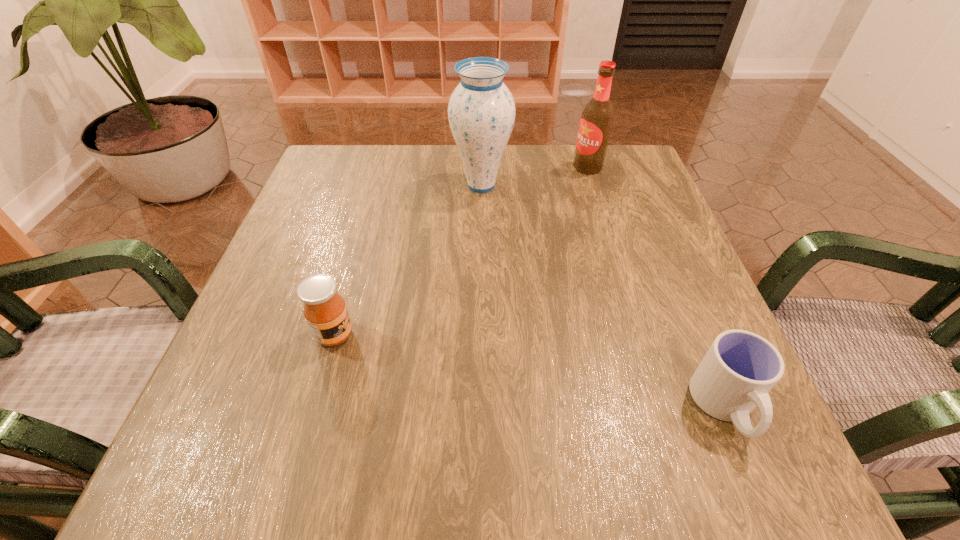
You are a GUI agent. You are given a task and a screenshot of the screen. Output one action in this format:
    pyautogui.click(x=<x>, y=<y>)
    Task: Click on the third object from right to left
    
    Given the screenshot: What is the action you would take?
    pyautogui.click(x=481, y=111)

Locate an element on the screen. beer bottle is located at coordinates (597, 117).

At what (x,y) coordinates should I click in order to perform the action: click on the leftmost object. Please return your answer as a coordinate pair (x, y). The width and height of the screenshot is (960, 540). Looking at the image, I should click on (325, 311).

Locate an element on the screen. The width and height of the screenshot is (960, 540). honey is located at coordinates (325, 311).

The height and width of the screenshot is (540, 960). I want to click on the rightmost object, so click(x=739, y=369).

What are the coordinates of `the nearest object` in the screenshot? It's located at [x=739, y=369].

Identify the location of free space located 0.310m on the left of the vase. (320, 185).

At what (x,y) coordinates should I click in order to perform the action: click on vacant space located 0.170m on the left of the beer bottle. Please return your answer as a coordinate pair (x, y). The image size is (960, 540). Looking at the image, I should click on (504, 167).

This screenshot has height=540, width=960. In order to click on vacant space situated 0.180m on the front-facing side of the third farthest object in this screenshot , I will do `click(462, 335)`.

Where is `vase located in the far edge section of the desktop`? vase located in the far edge section of the desktop is located at coordinates (481, 111).